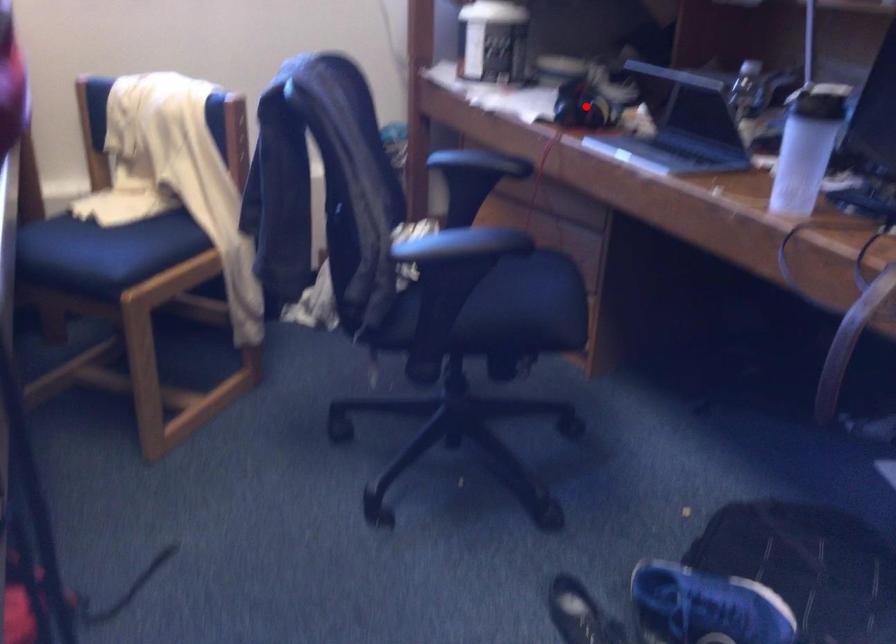
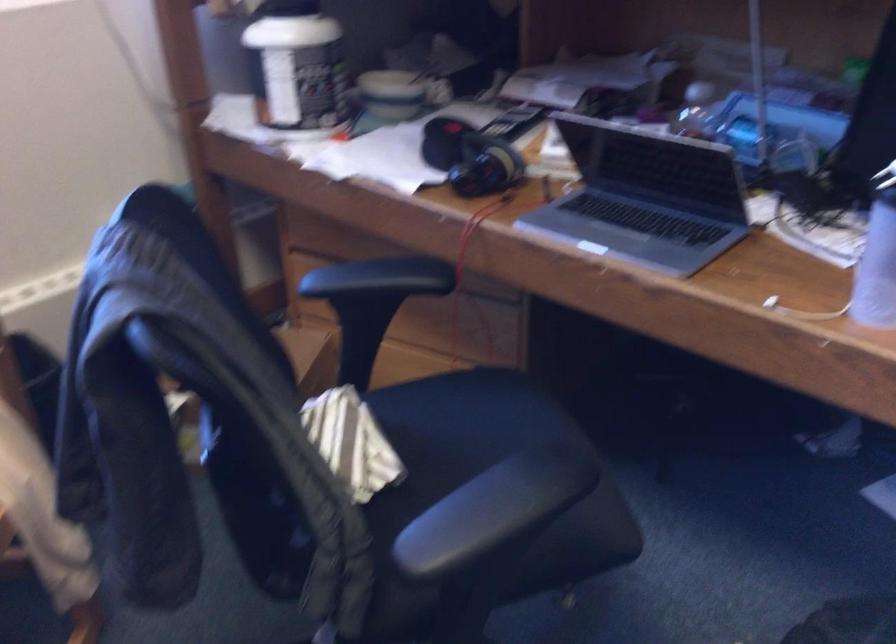
Question: I am providing you with two images of the same scene from different viewpoints. A red point is shown in image1. For the corresponding object point in image2, is it positioned nearer or farther from the camera?

Choices:
 (A) Nearer
 (B) Farther

Answer: (A)